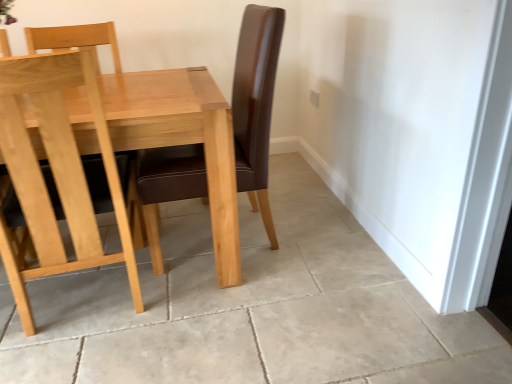
In order to click on free space in front of light brown wood chair at left in this screenshot , I will do `click(86, 358)`.